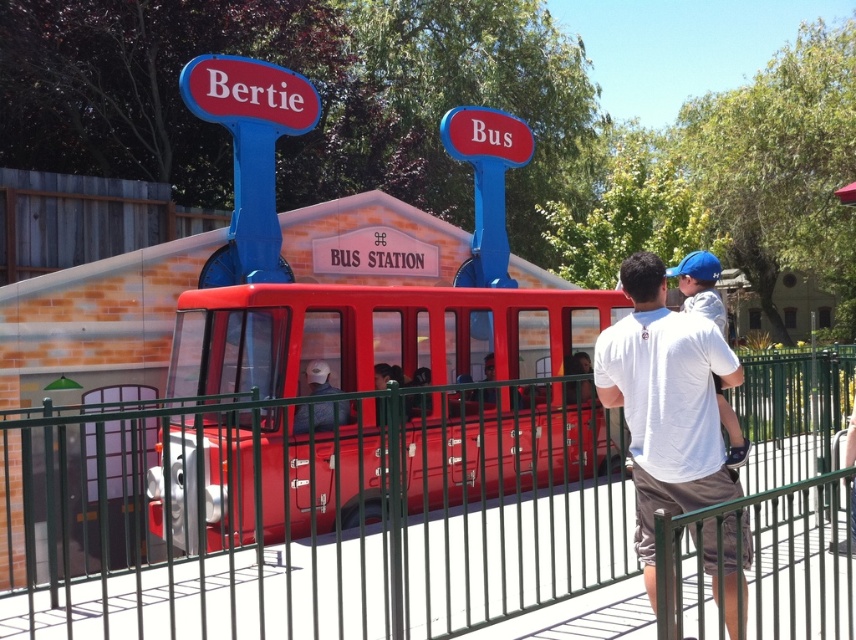
Is green metal fence at center further to the viewer compared to shiny red train car at center?

No, green metal fence at center is in front of shiny red train car at center.

Who is positioned more to the right, green metal fence at center or shiny red train car at center?

Positioned to the right is green metal fence at center.

Who is more forward, (183, 589) or (313, 321)?

Point (183, 589) is more forward.

Where is `green metal fence at center`? The width and height of the screenshot is (856, 640). green metal fence at center is located at coordinates (311, 518).

You are a GUI agent. You are given a task and a screenshot of the screen. Output one action in this format:
    pyautogui.click(x=<x>, y=<y>)
    Task: Click on the green metal fence at center
    Image resolution: width=856 pixels, height=640 pixels.
    Given the screenshot: What is the action you would take?
    pyautogui.click(x=311, y=518)

Which is below, green metal fence at center or white cotton shirt at center?

green metal fence at center

Image resolution: width=856 pixels, height=640 pixels. Find the location of `green metal fence at center`. green metal fence at center is located at coordinates (311, 518).

Is white cotton shirt at center positioned in front of matte black helmet at center?

Yes, white cotton shirt at center is in front of matte black helmet at center.

Which is below, white cotton shirt at center or matte black helmet at center?

white cotton shirt at center

Locate an element on the screen. This screenshot has width=856, height=640. white cotton shirt at center is located at coordinates (664, 403).

This screenshot has width=856, height=640. I want to click on white cotton shirt at center, so click(x=664, y=403).